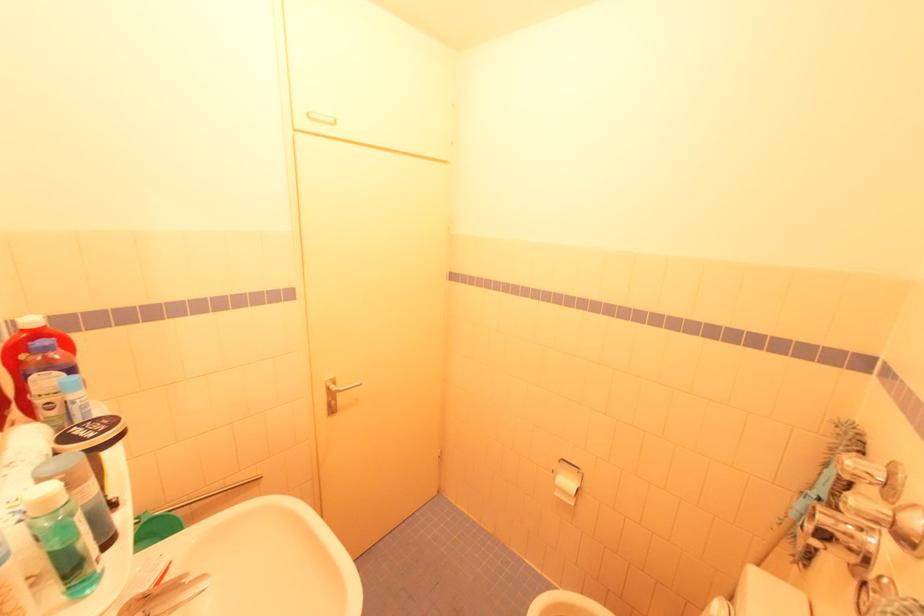
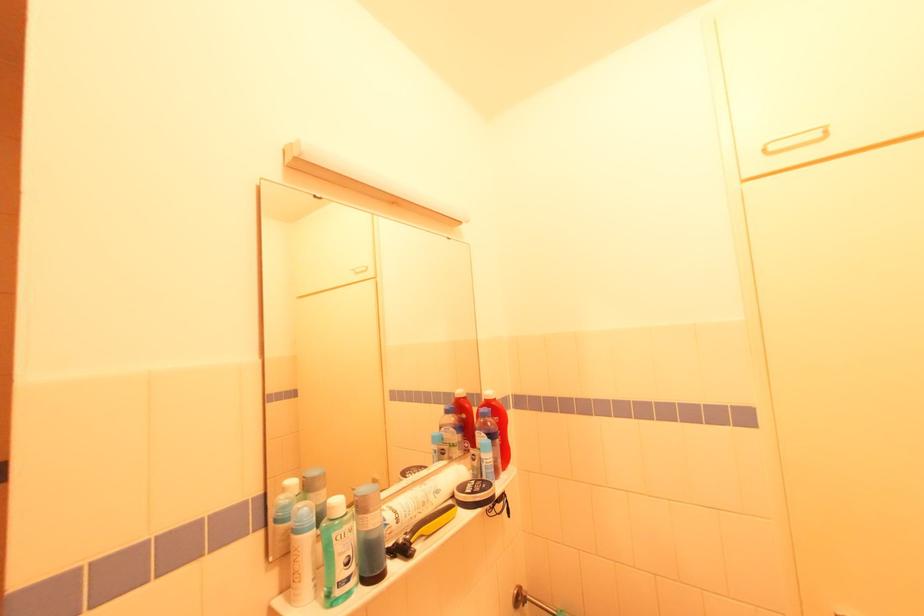
The point at (55, 339) is marked in the first image. Where is the corresponding point in the second image?

(492, 410)